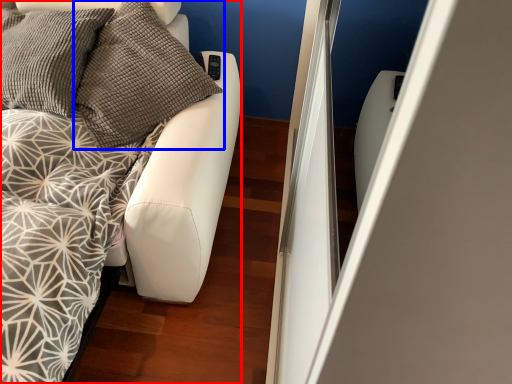
Question: Which point is closer to the camera, furniture (highlighted by a red box) or pillow (highlighted by a blue box)?

Choices:
 (A) furniture
 (B) pillow

Answer: (A)